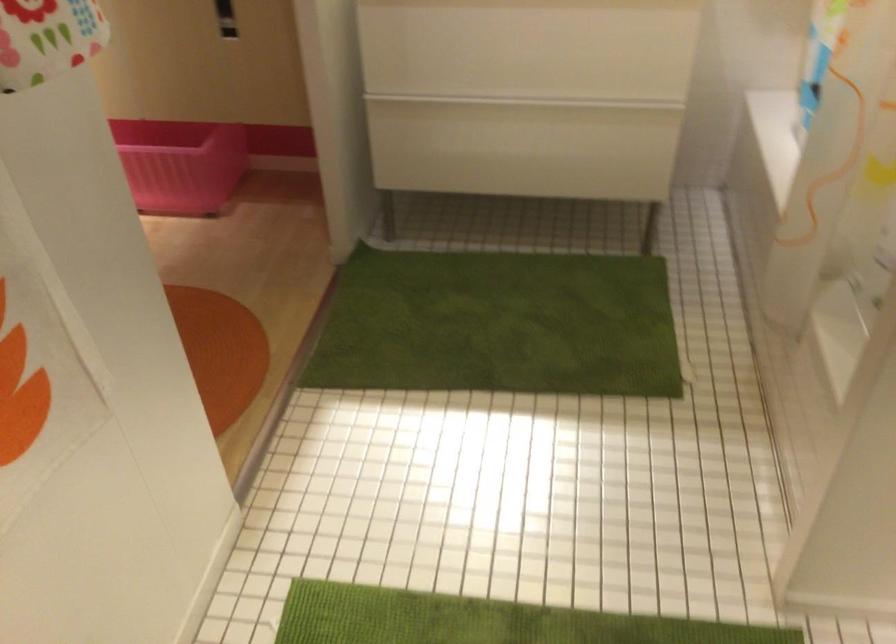
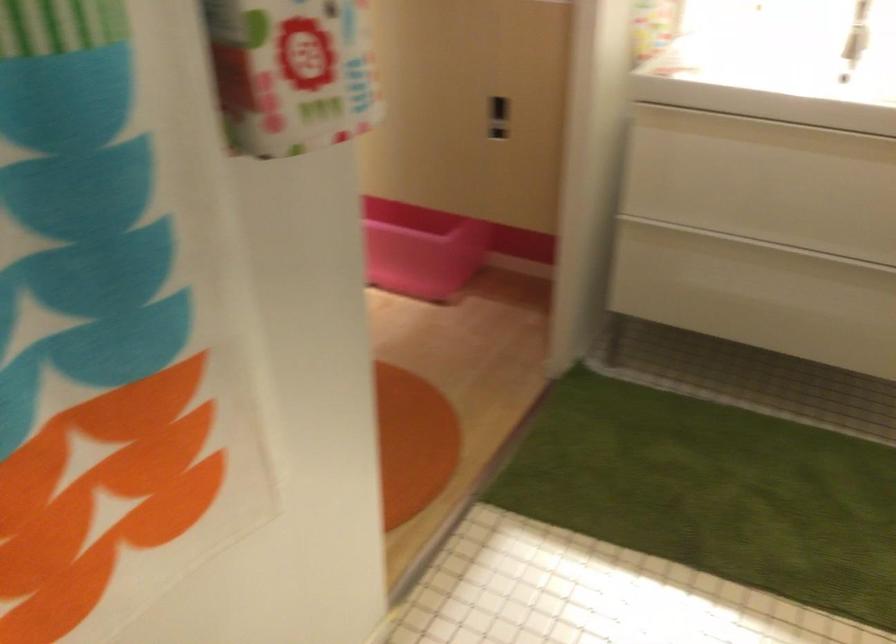
Find the pixel in the second image that matches (468,117) in the first image.

(734, 254)